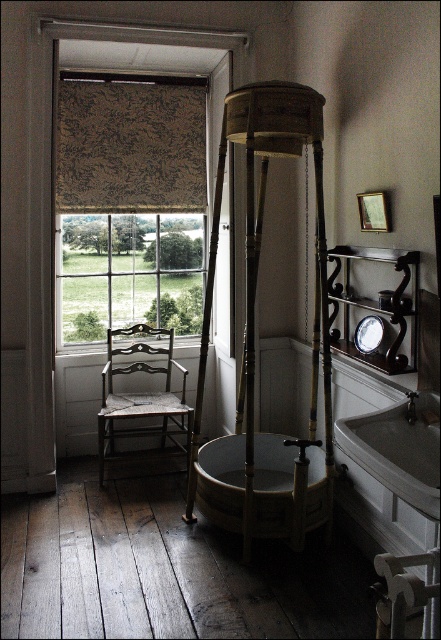
Question: Does white porcelain sink at lower right have a greater width compared to wooden chair at left?

Choices:
 (A) yes
 (B) no

Answer: (B)

Question: Where is textured beige fabric at upper left located in relation to white porcelain sink at lower right in the image?

Choices:
 (A) below
 (B) above

Answer: (B)

Question: Among these objects, which one is farthest from the camera?

Choices:
 (A) white porcelain sink at lower right
 (B) textured beige fabric at upper left
 (C) wooden chair at left
 (D) brown textured curtain at upper left

Answer: (D)

Question: Which object is closer to the camera taking this photo?

Choices:
 (A) textured beige fabric at upper left
 (B) brown textured curtain at upper left
 (C) wooden chair at left

Answer: (A)

Question: Which point is closer to the camera?

Choices:
 (A) (109, 317)
 (B) (359, 440)
 (C) (60, 124)
 (D) (103, 452)

Answer: (B)

Question: Can you confirm if textured beige fabric at upper left is positioned above wooden chair at left?

Choices:
 (A) yes
 (B) no

Answer: (A)